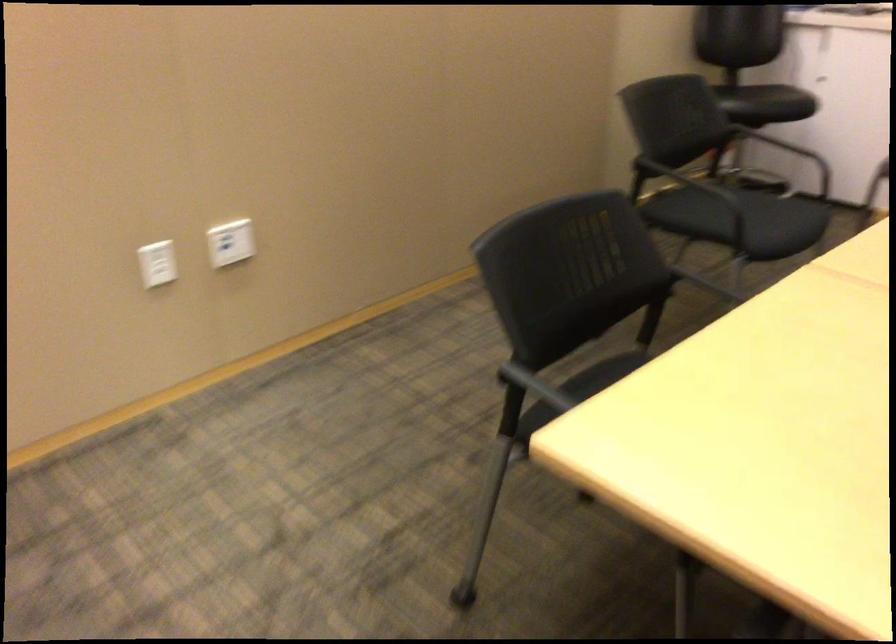
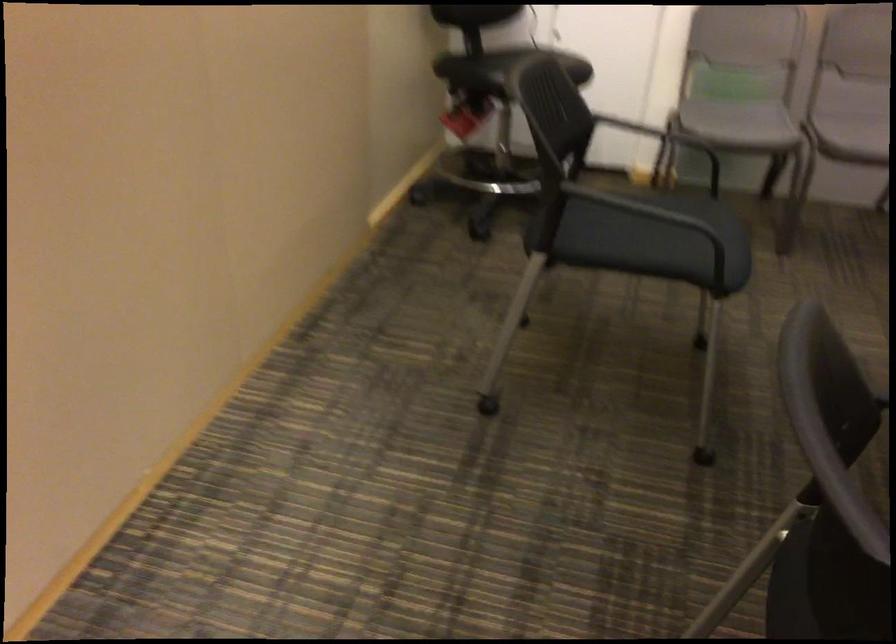
Find the pixel in the second image that matches point 748,211 in the first image.

(657, 222)